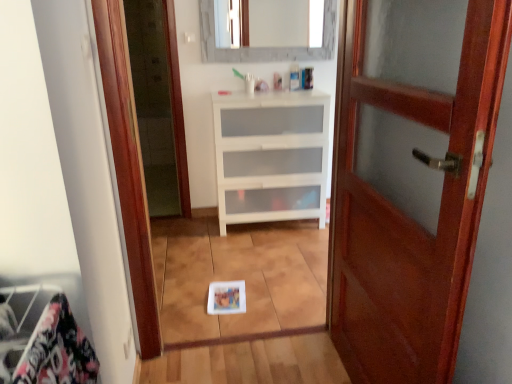
Question: Does mahogany wood door at right have a lesser width compared to matte gray mirror at upper center?

Choices:
 (A) no
 (B) yes

Answer: (A)

Question: Is the position of mahogany wood door at right more distant than that of matte gray mirror at upper center?

Choices:
 (A) yes
 (B) no

Answer: (B)

Question: Is mahogany wood door at right closer to camera compared to matte gray mirror at upper center?

Choices:
 (A) yes
 (B) no

Answer: (A)

Question: Is mahogany wood door at right looking in the opposite direction of matte gray mirror at upper center?

Choices:
 (A) no
 (B) yes

Answer: (A)

Question: Is mahogany wood door at right not close to matte gray mirror at upper center?

Choices:
 (A) no
 (B) yes

Answer: (B)

Question: From a real-world perspective, is mahogany wood door at right located higher than matte gray mirror at upper center?

Choices:
 (A) yes
 (B) no

Answer: (B)

Question: Does matte gray mirror at upper center have a lesser width compared to white matte chest of drawers at center?

Choices:
 (A) no
 (B) yes

Answer: (B)

Question: Would you say white matte chest of drawers at center is part of matte gray mirror at upper center's contents?

Choices:
 (A) no
 (B) yes

Answer: (A)

Question: From the image's perspective, is matte gray mirror at upper center located beneath white matte chest of drawers at center?

Choices:
 (A) no
 (B) yes

Answer: (A)

Question: Does matte gray mirror at upper center have a greater height compared to white matte chest of drawers at center?

Choices:
 (A) yes
 (B) no

Answer: (B)

Question: Considering the relative sizes of matte gray mirror at upper center and white matte chest of drawers at center in the image provided, is matte gray mirror at upper center smaller than white matte chest of drawers at center?

Choices:
 (A) no
 (B) yes

Answer: (B)

Question: Is matte gray mirror at upper center in front of white matte chest of drawers at center?

Choices:
 (A) no
 (B) yes

Answer: (A)

Question: Is white matte chest of drawers at center positioned behind matte gray mirror at upper center?

Choices:
 (A) yes
 (B) no

Answer: (B)